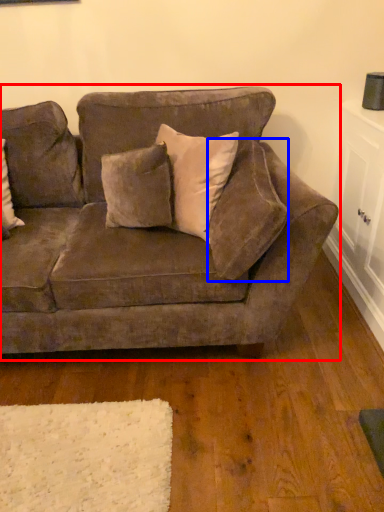
Question: Among these objects, which one is farthest to the camera, studio couch (highlighted by a red box) or pillow (highlighted by a blue box)?

Choices:
 (A) studio couch
 (B) pillow

Answer: (A)